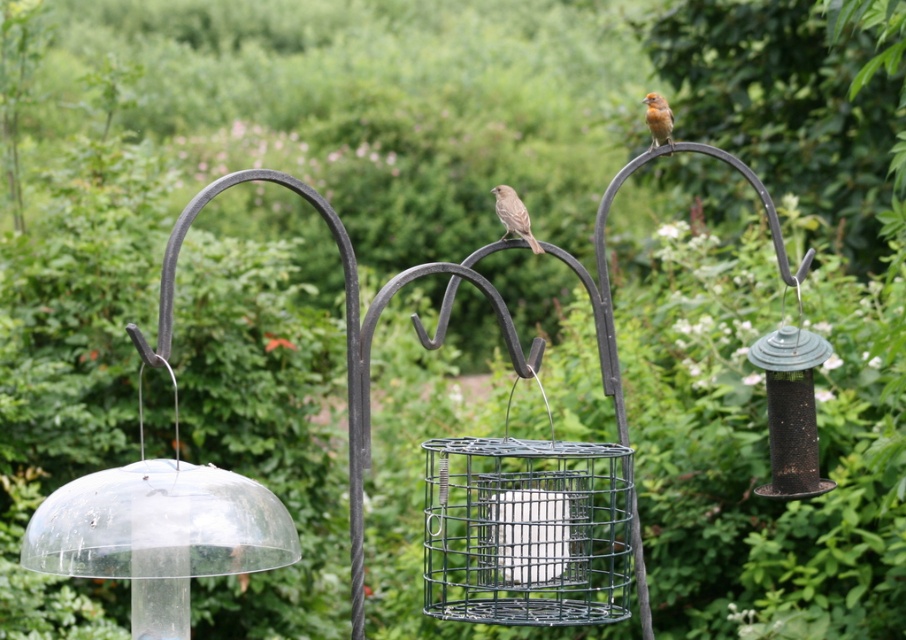
Question: Is wire mesh bird feeder at center bigger than brown feathered bird at center?

Choices:
 (A) no
 (B) yes

Answer: (B)

Question: Can you confirm if wire mesh bird feeder at center is smaller than brown speckled feathers at upper right?

Choices:
 (A) no
 (B) yes

Answer: (A)

Question: Which object is positioned closest to the brown speckled feathers at upper right?

Choices:
 (A) brown feathered bird at center
 (B) wire mesh bird feeder at center

Answer: (A)

Question: Estimate the real-world distances between objects in this image. Which object is closer to the brown speckled feathers at upper right?

Choices:
 (A) wire mesh bird feeder at center
 (B) brown feathered bird at center

Answer: (B)

Question: Can you confirm if wire mesh bird feeder at center is positioned above brown feathered bird at center?

Choices:
 (A) no
 (B) yes

Answer: (A)

Question: Which point is closer to the camera?

Choices:
 (A) brown speckled feathers at upper right
 (B) brown feathered bird at center
 (C) wire mesh bird feeder at center

Answer: (C)